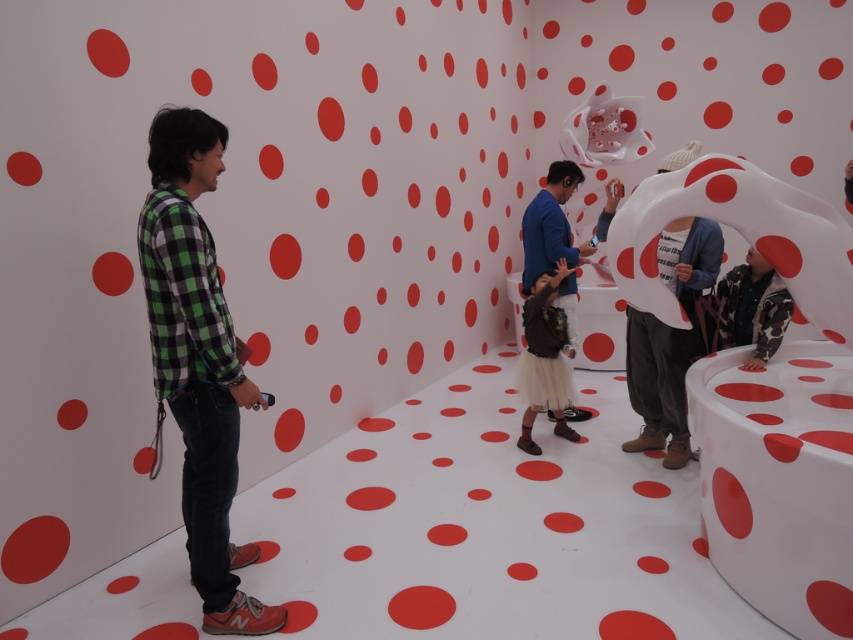
Question: Is brown fabric skirt at center bigger than brown leather jacket at center?

Choices:
 (A) no
 (B) yes

Answer: (A)

Question: Does green checkered shirt at left have a smaller size compared to brown leather jacket at center?

Choices:
 (A) no
 (B) yes

Answer: (A)

Question: Which point is closer to the camera?

Choices:
 (A) (635, 412)
 (B) (558, 273)
 (C) (248, 396)
 (D) (558, 195)

Answer: (C)

Question: Which point is farther to the camera?

Choices:
 (A) brown leather jacket at center
 (B) white matte sculpture at center

Answer: (A)

Question: Can you confirm if green checkered shirt at left is wider than brown fabric skirt at center?

Choices:
 (A) no
 (B) yes

Answer: (B)

Question: Which of the following is the farthest from the observer?

Choices:
 (A) (546, 230)
 (B) (692, 301)
 (C) (550, 404)

Answer: (A)